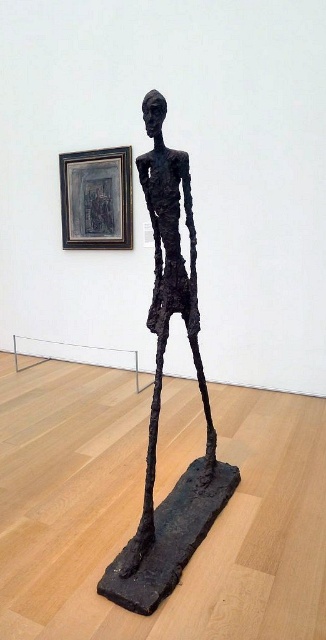
Who is lower down, rusty metal figure at center or matte black frame at upper left?

rusty metal figure at center is below.

Is point (157, 301) behind point (76, 177)?

No.

I want to click on rusty metal figure at center, so click(x=160, y=396).